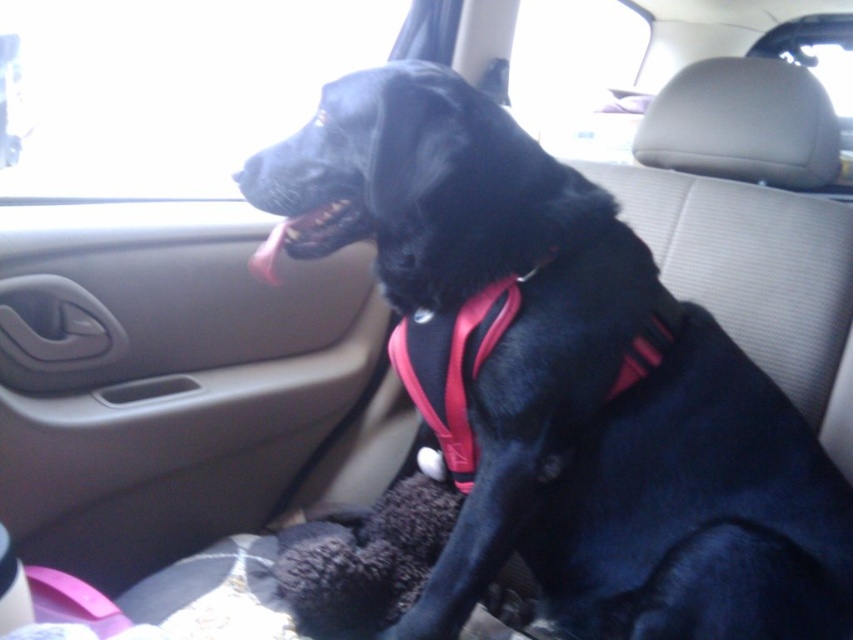
Between black matte dog at center and black matte teeth at center, which one has more height?

black matte dog at center

Is black matte dog at center shorter than black matte teeth at center?

No, black matte dog at center is not shorter than black matte teeth at center.

The height and width of the screenshot is (640, 853). I want to click on black matte dog at center, so click(566, 381).